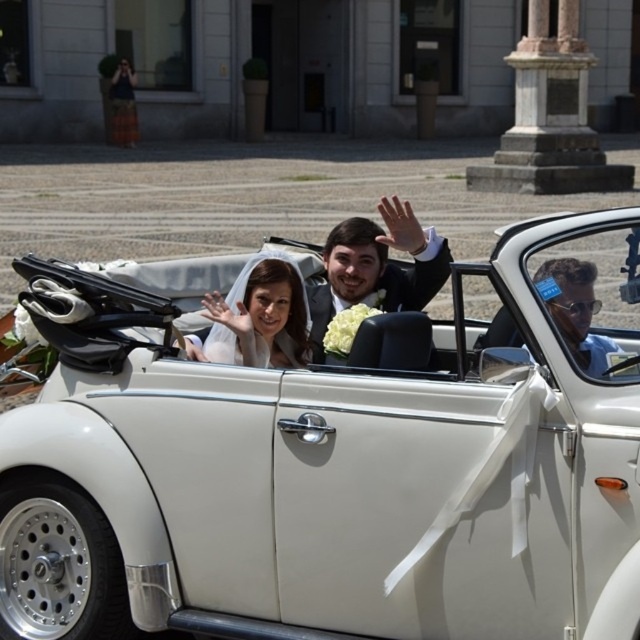
Question: Estimate the real-world distances between objects in this image. Which object is farther from the matte black suit at center?

Choices:
 (A) white satin veil at center
 (B) white matte convertible car at center
 (C) sunglassesmaterial/texture at position

Answer: (C)

Question: Is white matte convertible car at center to the right of matte black suit at center from the viewer's perspective?

Choices:
 (A) yes
 (B) no

Answer: (B)

Question: Which object is farther from the camera taking this photo?

Choices:
 (A) white satin veil at center
 (B) sunglassesmaterial/texture at position
 (C) white matte convertible car at center

Answer: (A)

Question: Is white satin veil at center thinner than sunglassesmaterial/texture at position?

Choices:
 (A) yes
 (B) no

Answer: (B)

Question: Which point is farther to the camera?

Choices:
 (A) white matte convertible car at center
 (B) white satin veil at center
 (C) matte black suit at center
 (D) sunglassesmaterial/texture at position

Answer: (C)

Question: Can you confirm if matte black suit at center is bigger than sunglassesmaterial/texture at position?

Choices:
 (A) no
 (B) yes

Answer: (B)